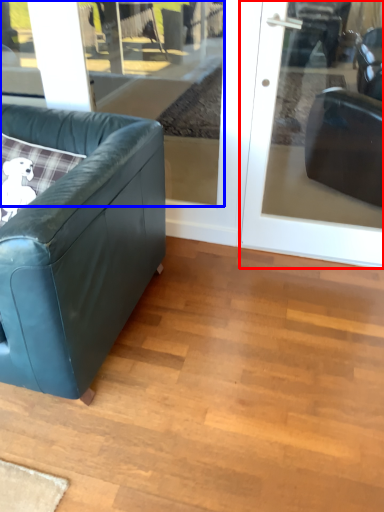
Question: Which point is further to the camera, door (highlighted by a red box) or window (highlighted by a blue box)?

Choices:
 (A) door
 (B) window

Answer: (B)